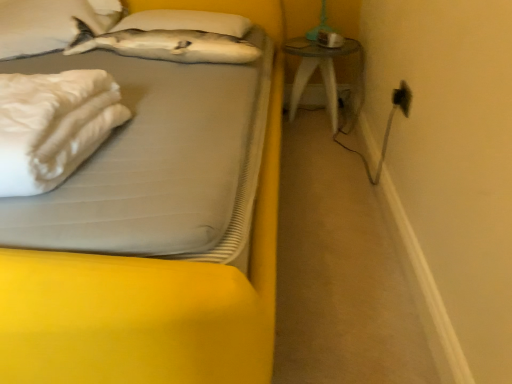
Describe the element at coordinates (402, 98) in the screenshot. I see `black plastic electric outlet at upper right` at that location.

Locate an element on the screen. white soft bed at upper left is located at coordinates (151, 288).

This screenshot has width=512, height=384. Describe the element at coordinates (151, 288) in the screenshot. I see `white soft bed at upper left` at that location.

Locate an element on the screen. white soft fabric at left is located at coordinates (53, 126).

Is transparent glass table at right beside black plastic electric outlet at upper right?

transparent glass table at right and black plastic electric outlet at upper right are clearly separated.

From a real-world perspective, is transparent glass table at right physically above black plastic electric outlet at upper right?

Incorrect, from a real-world perspective, transparent glass table at right is lower than black plastic electric outlet at upper right.

Between transparent glass table at right and black plastic electric outlet at upper right, which one has smaller size?

With smaller size is black plastic electric outlet at upper right.

From the image's perspective, would you say transparent glass table at right is positioned over black plastic electric outlet at upper right?

Yes, from the image's perspective, transparent glass table at right is above black plastic electric outlet at upper right.

Considering the relative sizes of transparent glass table at right and white soft pillow at upper center, which is the second pillow from left to right, in the image provided, is transparent glass table at right bigger than white soft pillow at upper center, which is the second pillow from left to right,?

Yes.

Considering the points (288, 52) and (195, 28), which point is behind, point (288, 52) or point (195, 28)?

The point (288, 52) is more distant.

Are transparent glass table at right and white soft pillow at upper center, which is the second pillow from left to right, far apart?

No, transparent glass table at right is in close proximity to white soft pillow at upper center, which is the second pillow from left to right.

Image resolution: width=512 pixels, height=384 pixels. What are the coordinates of `the 1st pillow to the left of the transparent glass table at right, counting from the anchor's position` in the screenshot? It's located at pyautogui.click(x=186, y=22).

Consider the image. From a real-world perspective, is white matte pillow at upper left, marked as the 1th pillow in a left-to-right arrangement, positioned over white soft bed at upper left based on gravity?

Yes, from a real-world perspective, white matte pillow at upper left, marked as the 1th pillow in a left-to-right arrangement, is above white soft bed at upper left.

Is white soft bed at upper left a part of white matte pillow at upper left, which is counted as the 2th pillow, starting from the right?

Definitely not — white soft bed at upper left is not inside white matte pillow at upper left, which is counted as the 2th pillow, starting from the right.

Is white matte pillow at upper left, which is counted as the 2th pillow, starting from the right, at the right side of white soft bed at upper left?

No, white matte pillow at upper left, which is counted as the 2th pillow, starting from the right, is not to the right of white soft bed at upper left.

Is white matte pillow at upper left, marked as the 1th pillow in a left-to-right arrangement, facing away from transparent glass table at right?

No, white matte pillow at upper left, marked as the 1th pillow in a left-to-right arrangement, is not facing away from transparent glass table at right.

From a real-world perspective, is white matte pillow at upper left, which is counted as the 2th pillow, starting from the right, positioned above or below transparent glass table at right?

In terms of real-world spatial position, white matte pillow at upper left, which is counted as the 2th pillow, starting from the right, is above transparent glass table at right.

Measure the distance between white matte pillow at upper left, marked as the 1th pillow in a left-to-right arrangement, and transparent glass table at right.

They are 3.63 feet apart.

Can you confirm if white matte pillow at upper left, which is counted as the 2th pillow, starting from the right, is smaller than transparent glass table at right?

Yes, white matte pillow at upper left, which is counted as the 2th pillow, starting from the right, is smaller than transparent glass table at right.

Which of these two, white matte pillow at upper left, which is counted as the 2th pillow, starting from the right, or white soft fabric at left, is bigger?

With larger size is white matte pillow at upper left, which is counted as the 2th pillow, starting from the right.

From a real-world perspective, is white matte pillow at upper left, marked as the 1th pillow in a left-to-right arrangement, beneath white soft fabric at left?

No, from a real-world perspective, white matte pillow at upper left, marked as the 1th pillow in a left-to-right arrangement, is not under white soft fabric at left.

From the image's perspective, does white matte pillow at upper left, which is counted as the 2th pillow, starting from the right, appear higher than white soft fabric at left?

Correct, white matte pillow at upper left, which is counted as the 2th pillow, starting from the right, appears higher than white soft fabric at left in the image.

Consider the image. From the image's perspective, would you say black plastic electric outlet at upper right is shown under white soft fabric at left?

Actually, black plastic electric outlet at upper right appears above white soft fabric at left in the image.

Is black plastic electric outlet at upper right further to the viewer compared to white soft fabric at left?

Yes.

Is black plastic electric outlet at upper right facing towards white soft fabric at left?

Yes, black plastic electric outlet at upper right is oriented towards white soft fabric at left.

Which of these two, black plastic electric outlet at upper right or white soft fabric at left, is bigger?

white soft fabric at left.

Is white soft pillow at upper center, which is the second pillow from left to right, inside white soft fabric at left?

No, white soft pillow at upper center, which is the second pillow from left to right, is not surrounded by white soft fabric at left.

How many degrees apart are the facing directions of white soft fabric at left and white soft pillow at upper center, which is the second pillow from left to right?

7.92 degrees separate the facing orientations of white soft fabric at left and white soft pillow at upper center, which is the second pillow from left to right.

Which of these two, white soft fabric at left or white soft pillow at upper center, marked as the 1th pillow in a right-to-left arrangement, stands shorter?

Standing shorter between the two is white soft pillow at upper center, marked as the 1th pillow in a right-to-left arrangement.

Is the depth of white soft fabric at left greater than that of white soft pillow at upper center, which is the second pillow from left to right?

No, white soft fabric at left is in front of white soft pillow at upper center, which is the second pillow from left to right.

Locate an element on the screen. This screenshot has height=384, width=512. table that is behind the black plastic electric outlet at upper right is located at coordinates (315, 69).

Locate an element on the screen. This screenshot has width=512, height=384. table on the right of white soft pillow at upper center, which is the second pillow from left to right is located at coordinates (315, 69).

When comparing their distances from white soft fabric at left, does white soft pillow at upper center, marked as the 1th pillow in a right-to-left arrangement, or white soft bed at upper left seem closer?

white soft bed at upper left lies closer to white soft fabric at left than the other object.

From the picture: Which object lies further to the anchor point white soft pillow at upper center, which is the second pillow from left to right, black plastic electric outlet at upper right or white soft bed at upper left?

Among the two, white soft bed at upper left is located further to white soft pillow at upper center, which is the second pillow from left to right.

Estimate the real-world distances between objects in this image. Which object is further from white soft fabric at left, black plastic electric outlet at upper right or white soft bed at upper left?

Among the two, black plastic electric outlet at upper right is located further to white soft fabric at left.

Which object lies further to the anchor point white matte pillow at upper left, marked as the 1th pillow in a left-to-right arrangement, white soft fabric at left or white soft pillow at upper center, which is the second pillow from left to right?

Among the two, white soft fabric at left is located further to white matte pillow at upper left, marked as the 1th pillow in a left-to-right arrangement.

From the picture: From the image, which object appears to be farther from black plastic electric outlet at upper right, white soft bed at upper left or white soft fabric at left?

Based on the image, white soft fabric at left appears to be further to black plastic electric outlet at upper right.

When comparing their distances from white soft pillow at upper center, which is the second pillow from left to right, does white matte pillow at upper left, which is counted as the 2th pillow, starting from the right, or white soft fabric at left seem further?

white soft fabric at left.

Which object lies further to the anchor point black plastic electric outlet at upper right, transparent glass table at right or white soft bed at upper left?

white soft bed at upper left.

Considering their positions, is white soft bed at upper left positioned closer to white matte pillow at upper left, marked as the 1th pillow in a left-to-right arrangement, than transparent glass table at right?

transparent glass table at right is closer to white matte pillow at upper left, marked as the 1th pillow in a left-to-right arrangement.

Locate an element on the screen. The image size is (512, 384). material between white soft bed at upper left and white soft pillow at upper center, marked as the 1th pillow in a right-to-left arrangement, along the z-axis is located at coordinates (53, 126).

At what (x,y) coordinates should I click in order to perform the action: click on bed between white matte pillow at upper left, marked as the 1th pillow in a left-to-right arrangement, and black plastic electric outlet at upper right. Please return your answer as a coordinate pair (x, y). The image size is (512, 384). Looking at the image, I should click on (151, 288).

Identify the location of pillow between white soft fabric at left and white soft pillow at upper center, which is the second pillow from left to right, in the front-back direction. (50, 24).

Where is `electric outlet between white soft bed at upper left and white soft pillow at upper center, marked as the 1th pillow in a right-to-left arrangement, from front to back`? This screenshot has height=384, width=512. electric outlet between white soft bed at upper left and white soft pillow at upper center, marked as the 1th pillow in a right-to-left arrangement, from front to back is located at coordinates (402, 98).